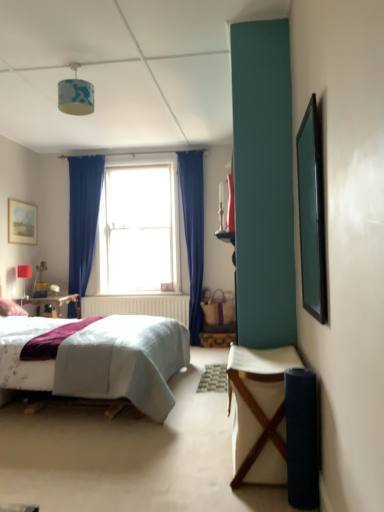
Question: Is green matte picture frame at right, placed as the second picture frame when sorted from left to right, oriented towards matte wooden picture frame at upper left, which is the 1th picture frame in back-to-front order?

Choices:
 (A) no
 (B) yes

Answer: (A)

Question: Can you confirm if green matte picture frame at right, arranged as the first picture frame when viewed from the front, is positioned to the right of matte wooden picture frame at upper left, positioned as the second picture frame in front-to-back order?

Choices:
 (A) yes
 (B) no

Answer: (A)

Question: Are green matte picture frame at right, which is the first picture frame in right-to-left order, and matte wooden picture frame at upper left, positioned as the second picture frame in front-to-back order, making contact?

Choices:
 (A) no
 (B) yes

Answer: (A)

Question: Does green matte picture frame at right, which is the first picture frame in right-to-left order, contain matte wooden picture frame at upper left, which is the 1th picture frame in back-to-front order?

Choices:
 (A) no
 (B) yes

Answer: (A)

Question: From a real-world perspective, does green matte picture frame at right, which is the first picture frame in right-to-left order, sit lower than matte wooden picture frame at upper left, positioned as the second picture frame in front-to-back order?

Choices:
 (A) no
 (B) yes

Answer: (B)

Question: From the image's perspective, is green matte picture frame at right, positioned as the second picture frame in back-to-front order, located beneath matte wooden picture frame at upper left, the first picture frame in the left-to-right sequence?

Choices:
 (A) no
 (B) yes

Answer: (B)

Question: Is matte red lampshade at upper left, which is the 2th lamp in right-to-left order, turned away from matte wooden picture frame at upper left, which is the 1th picture frame in back-to-front order?

Choices:
 (A) yes
 (B) no

Answer: (B)

Question: Is matte red lampshade at upper left, which is the 2th lamp in right-to-left order, located outside matte wooden picture frame at upper left, the first picture frame in the left-to-right sequence?

Choices:
 (A) no
 (B) yes

Answer: (B)

Question: Can you confirm if matte red lampshade at upper left, which is the 2th lamp in right-to-left order, is wider than matte wooden picture frame at upper left, which is the 1th picture frame in back-to-front order?

Choices:
 (A) yes
 (B) no

Answer: (A)

Question: Considering the relative sizes of matte red lampshade at upper left, which is the 2th lamp in right-to-left order, and matte wooden picture frame at upper left, the 2th picture frame positioned from the right, in the image provided, is matte red lampshade at upper left, which is the 2th lamp in right-to-left order, bigger than matte wooden picture frame at upper left, the 2th picture frame positioned from the right,?

Choices:
 (A) yes
 (B) no

Answer: (B)

Question: Is matte red lampshade at upper left, marked as the second lamp in a top-to-bottom arrangement, smaller than matte wooden picture frame at upper left, positioned as the second picture frame in front-to-back order?

Choices:
 (A) no
 (B) yes

Answer: (B)

Question: From a real-world perspective, is matte red lampshade at upper left, acting as the 1th lamp starting from the back, positioned under matte wooden picture frame at upper left, the first picture frame in the left-to-right sequence, based on gravity?

Choices:
 (A) yes
 (B) no

Answer: (A)

Question: Is matte red lampshade at upper left, which is counted as the first lamp, starting from the bottom, at the back of green matte picture frame at right, positioned as the second picture frame in back-to-front order?

Choices:
 (A) no
 (B) yes

Answer: (A)